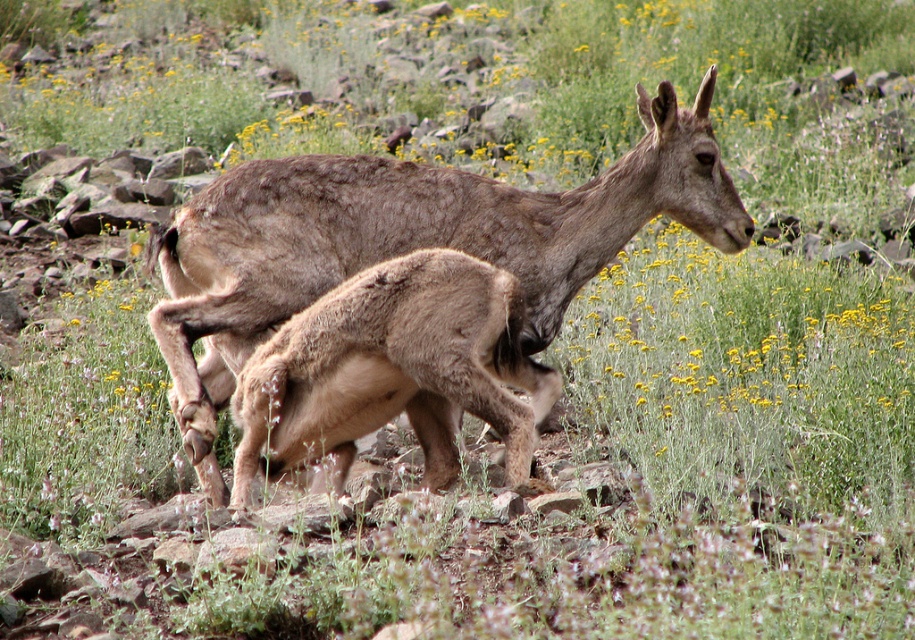
Question: Observing the image, what is the correct spatial positioning of brown woolen deer at center in reference to brown woolen baby deer at center?

Choices:
 (A) left
 (B) right

Answer: (B)

Question: Which object is farther from the camera taking this photo?

Choices:
 (A) brown woolen deer at center
 (B) brown woolen baby deer at center

Answer: (A)

Question: Where is brown woolen deer at center located in relation to brown woolen baby deer at center in the image?

Choices:
 (A) below
 (B) above

Answer: (B)

Question: Does brown woolen deer at center have a lesser width compared to brown woolen baby deer at center?

Choices:
 (A) no
 (B) yes

Answer: (A)

Question: Among these points, which one is farthest from the camera?

Choices:
 (A) (414, 342)
 (B) (345, 156)

Answer: (B)